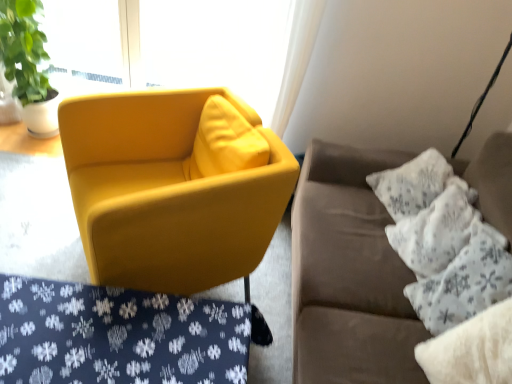
Question: Considering the relative positions of velvet yellow armchair at center and matte yellow armchair at center in the image provided, is velvet yellow armchair at center to the right of matte yellow armchair at center from the viewer's perspective?

Choices:
 (A) no
 (B) yes

Answer: (A)

Question: Is matte yellow armchair at center at the back of velvet yellow armchair at center?

Choices:
 (A) no
 (B) yes

Answer: (A)

Question: Can you confirm if velvet yellow armchair at center is wider than matte yellow armchair at center?

Choices:
 (A) no
 (B) yes

Answer: (B)

Question: From a real-world perspective, does velvet yellow armchair at center sit lower than matte yellow armchair at center?

Choices:
 (A) no
 (B) yes

Answer: (B)

Question: From the image's perspective, is velvet yellow armchair at center below matte yellow armchair at center?

Choices:
 (A) yes
 (B) no

Answer: (A)

Question: Could matte yellow armchair at center be considered to be inside velvet yellow armchair at center?

Choices:
 (A) yes
 (B) no

Answer: (B)

Question: Considering the relative sizes of matte yellow armchair at center and matte glass window at upper left in the image provided, is matte yellow armchair at center smaller than matte glass window at upper left?

Choices:
 (A) no
 (B) yes

Answer: (A)

Question: Can you confirm if matte yellow armchair at center is positioned to the left of matte glass window at upper left?

Choices:
 (A) no
 (B) yes

Answer: (A)

Question: From a real-world perspective, does matte yellow armchair at center stand above matte glass window at upper left?

Choices:
 (A) yes
 (B) no

Answer: (B)

Question: From the image's perspective, is matte yellow armchair at center located beneath matte glass window at upper left?

Choices:
 (A) no
 (B) yes

Answer: (B)

Question: Is matte yellow armchair at center completely or partially outside of matte glass window at upper left?

Choices:
 (A) no
 (B) yes

Answer: (B)

Question: Considering the relative sizes of matte yellow armchair at center and matte glass window at upper left in the image provided, is matte yellow armchair at center shorter than matte glass window at upper left?

Choices:
 (A) yes
 (B) no

Answer: (A)

Question: Is white fluffy pillow at right, which appears as the third pillow when viewed from the back, facing away from white textured pillow at right, positioned as the third pillow in front-to-back order?

Choices:
 (A) no
 (B) yes

Answer: (A)